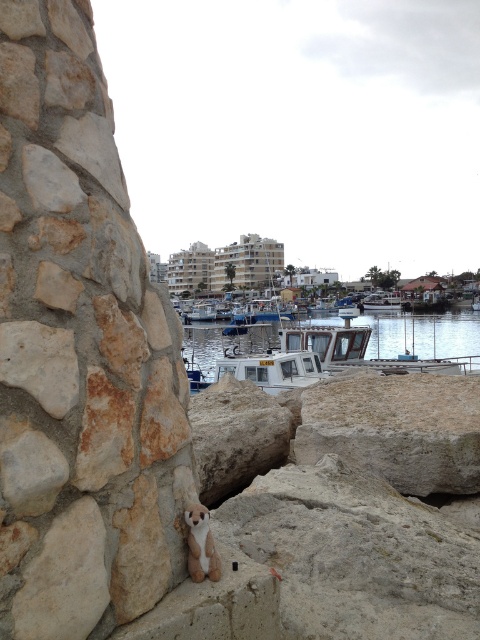
From the picture: Can you confirm if white fur dog at lower center is smaller than white plastic boat at center?

Correct, white fur dog at lower center occupies less space than white plastic boat at center.

Who is taller, white fur dog at lower center or white plastic boat at center?

white plastic boat at center is taller.

Find the location of a particular element. white fur dog at lower center is located at coordinates (201, 545).

Does clear water at center appear on the right side of white fur dog at lower center?

Indeed, clear water at center is positioned on the right side of white fur dog at lower center.

Between clear water at center and white fur dog at lower center, which one appears on the right side from the viewer's perspective?

Positioned to the right is clear water at center.

Which is in front, point (457, 358) or point (196, 580)?

Point (196, 580) is more forward.

The width and height of the screenshot is (480, 640). Find the location of `clear water at center`. clear water at center is located at coordinates (348, 340).

Which is more to the right, white plastic boat at center or white glossy boat at center?

From the viewer's perspective, white plastic boat at center appears more on the right side.

Can you confirm if white plastic boat at center is smaller than white glossy boat at center?

Indeed, white plastic boat at center has a smaller size compared to white glossy boat at center.

The image size is (480, 640). I want to click on white plastic boat at center, so click(x=381, y=301).

Locate an element on the screen. This screenshot has height=640, width=480. white plastic boat at center is located at coordinates (381, 301).